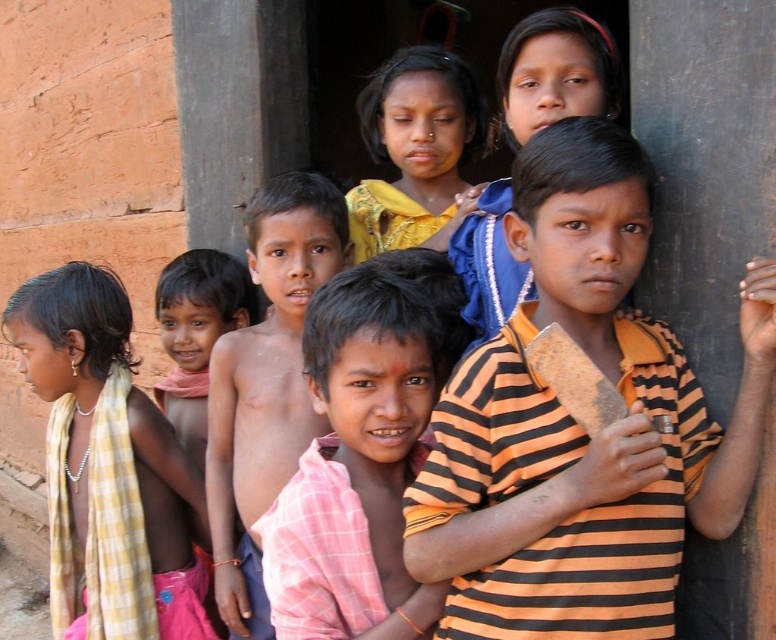
Which is more to the left, orange striped shirt at center or yellow fabric at center?

Positioned to the left is yellow fabric at center.

This screenshot has width=776, height=640. I want to click on orange striped shirt at center, so click(x=577, y=426).

Does orange striped shirt at center have a lesser height compared to shiny skin boy at center?

Yes, orange striped shirt at center is shorter than shiny skin boy at center.

Is orange striped shirt at center taller than shiny skin boy at center?

Incorrect, orange striped shirt at center's height is not larger of shiny skin boy at center's.

Is point (653, 429) positioned before point (279, 344)?

Yes.

The width and height of the screenshot is (776, 640). Find the location of `orange striped shirt at center`. orange striped shirt at center is located at coordinates (577, 426).

Which of these two, pink checkered shirt at center or shiny skin boy at center, stands taller?

With more height is shiny skin boy at center.

Does pink checkered shirt at center appear on the right side of shiny skin boy at center?

Yes, pink checkered shirt at center is to the right of shiny skin boy at center.

Does point (416, 467) lie in front of point (269, 252)?

Yes, point (416, 467) is closer to viewer.

The width and height of the screenshot is (776, 640). Find the location of `pink checkered shirt at center`. pink checkered shirt at center is located at coordinates (361, 445).